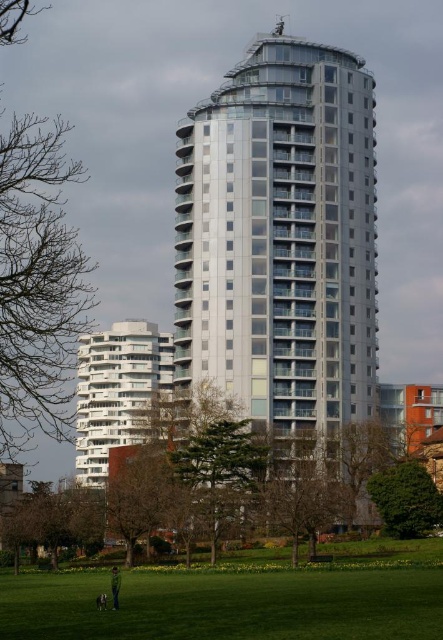
Question: Does silver/glassy tower at center appear on the right side of green leafy tree at lower left?

Choices:
 (A) yes
 (B) no

Answer: (A)

Question: Observing the image, what is the correct spatial positioning of silver/glassy tower at center in reference to bare branches at left?

Choices:
 (A) left
 (B) right

Answer: (B)

Question: Considering the real-world distances, which object is closest to the white glossy building at lower left?

Choices:
 (A) bare branches at left
 (B) green leafy tree at lower right
 (C) silver/glassy tower at center

Answer: (A)

Question: Considering the real-world distances, which object is farthest from the silver/glassy tower at center?

Choices:
 (A) bare branches at left
 (B) green fabric jacket at lower center

Answer: (B)

Question: Which of the following is the farthest from the observer?

Choices:
 (A) (69, 380)
 (B) (78, 481)
 (C) (422, 566)

Answer: (B)

Question: Is green grass at lower center thinner than green leafy tree at lower right?

Choices:
 (A) no
 (B) yes

Answer: (A)